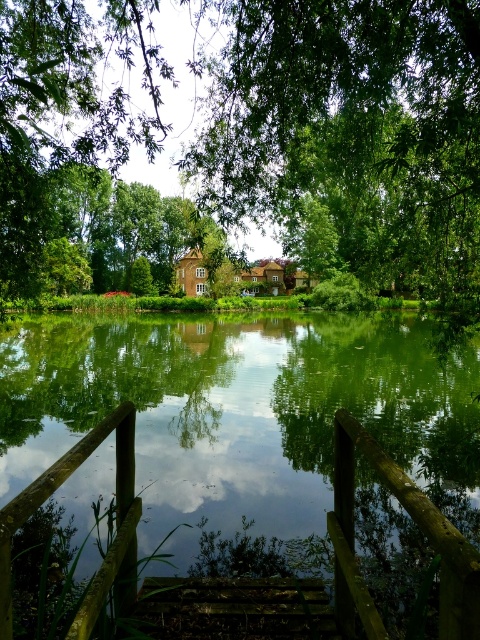
Between point (176, 234) and point (4, 628), which one is positioned in front?

Point (4, 628) is in front.

Which is below, green leafy tree at center or wooden rail at lower left?

wooden rail at lower left is below.

This screenshot has height=640, width=480. In order to click on green leafy tree at center in this screenshot , I will do `click(249, 140)`.

Where is `green leafy tree at center`? The height and width of the screenshot is (640, 480). green leafy tree at center is located at coordinates (249, 140).

Who is positioned more to the right, brown wooden rail at lower center or wooden rail at lower left?

brown wooden rail at lower center is more to the right.

Does brown wooden rail at lower center appear over wooden rail at lower left?

No.

Identify the location of brown wooden rail at lower center. The image size is (480, 640). (417, 524).

Who is positioned more to the right, brown wooden rail at center or brown wooden rail at lower center?

Positioned to the right is brown wooden rail at center.

Who is more distant from viewer, (436, 529) or (337, 516)?

The point (337, 516) is behind.

Is point (11, 589) behind point (348, 602)?

No, (11, 589) is closer to viewer.

Where is `brown wooden rail at center`? The image size is (480, 640). brown wooden rail at center is located at coordinates (419, 525).